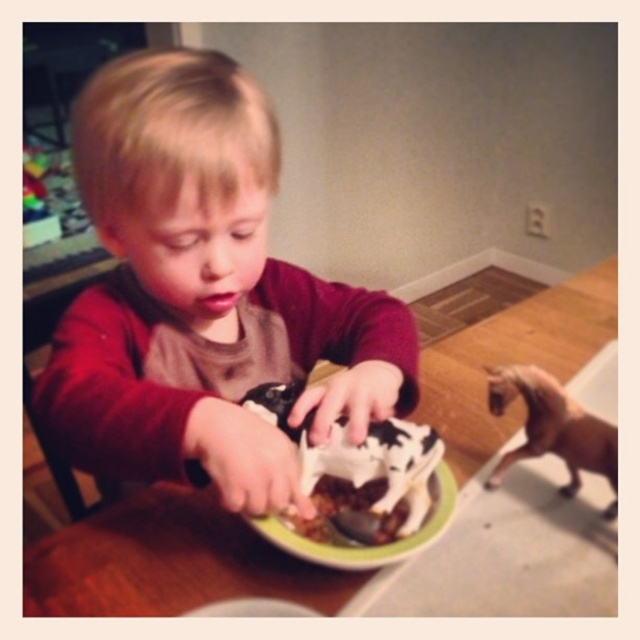
Can you confirm if matte brown shirt at center is positioned to the right of brown matte toy horse at lower right?

In fact, matte brown shirt at center is to the left of brown matte toy horse at lower right.

Between matte brown shirt at center and brown matte toy horse at lower right, which one has more height?

matte brown shirt at center is taller.

Where is `matte brown shirt at center`? Image resolution: width=640 pixels, height=640 pixels. matte brown shirt at center is located at coordinates (202, 292).

Does matte brown shirt at center have a greater height compared to chocolate frosted cake at center?

Yes, matte brown shirt at center is taller than chocolate frosted cake at center.

Between matte brown shirt at center and chocolate frosted cake at center, which one has less height?

With less height is chocolate frosted cake at center.

Is point (179, 381) closer to camera compared to point (376, 499)?

No, (179, 381) is further to viewer.

The height and width of the screenshot is (640, 640). Identify the location of matte brown shirt at center. (202, 292).

Looking at this image, between wooden table at center and brown matte toy horse at lower right, which one has less height?

brown matte toy horse at lower right

Between wooden table at center and brown matte toy horse at lower right, which one has more height?

wooden table at center

Who is more forward, (276,570) or (486,369)?

Positioned in front is point (276,570).

Find the location of `wooden table at center`. wooden table at center is located at coordinates (168, 563).